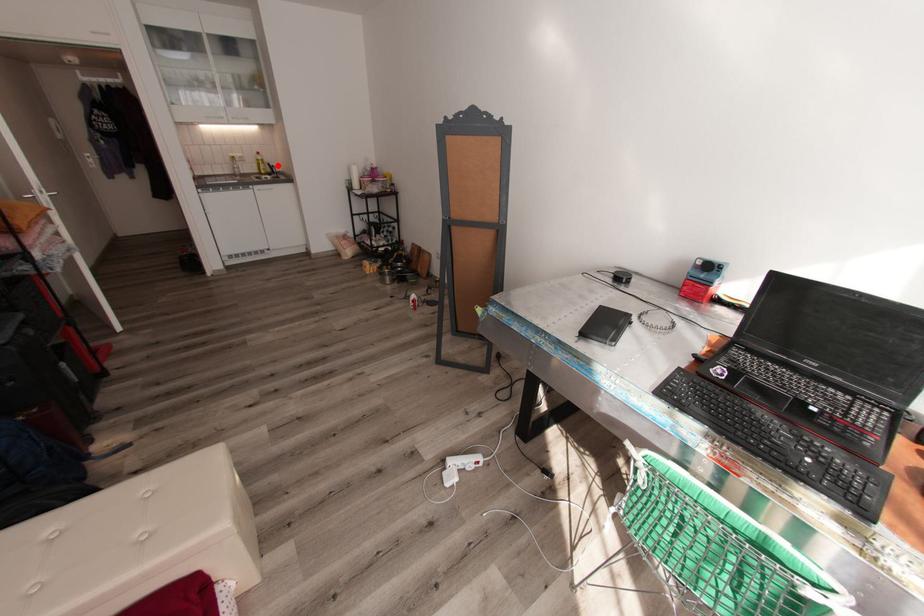
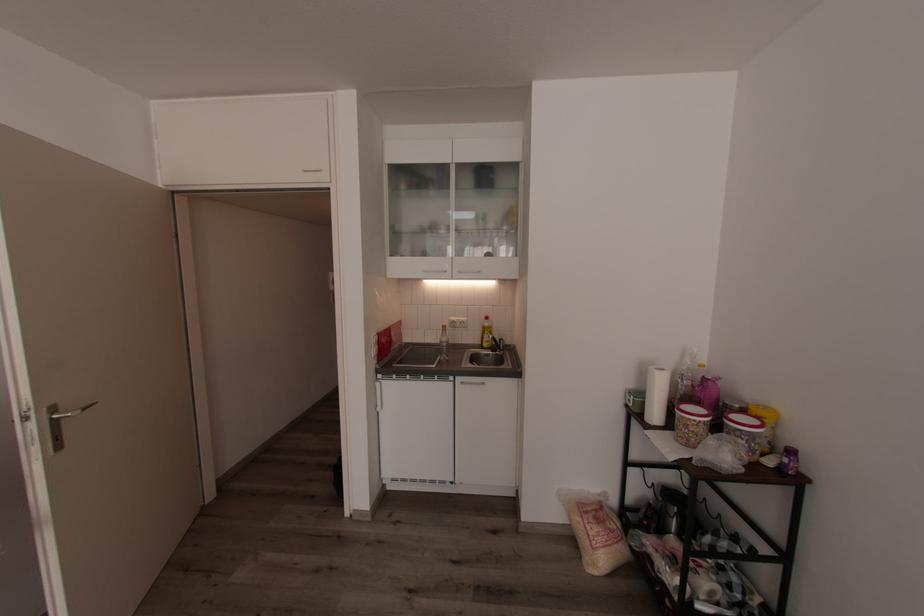
Question: I am providing you with two images of the same scene from different viewpoints. Given a red point in image1, look at the same physical point in image2. Is it:

Choices:
 (A) Closer to the viewpoint
 (B) Farther from the viewpoint

Answer: (B)